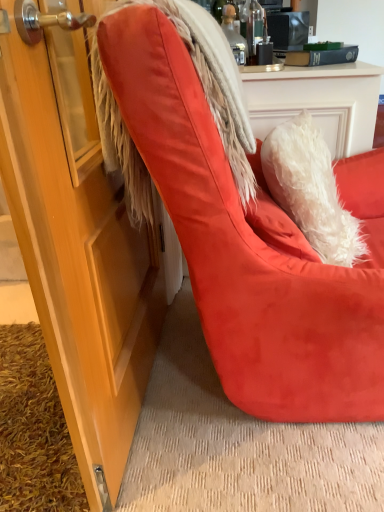
Describe the element at coordinates (120, 146) in the screenshot. The width and height of the screenshot is (384, 512). I see `fuzzy white fur coat at upper right` at that location.

Image resolution: width=384 pixels, height=512 pixels. Find the location of `fuzzy white fur coat at upper right`. fuzzy white fur coat at upper right is located at coordinates (120, 146).

This screenshot has width=384, height=512. What do you see at coordinates (244, 250) in the screenshot? I see `suede orange chair at center` at bounding box center [244, 250].

At what (x,y) coordinates should I click in order to perform the action: click on suede orange chair at center. Please return your answer as a coordinate pair (x, y). Image resolution: width=384 pixels, height=512 pixels. Looking at the image, I should click on (244, 250).

In order to face suede orange chair at center, should I rotate leftwards or rightwards?

You should look right and rotate roughly 16.061 degrees.

Identify the location of fuzzy white fur coat at upper right. (120, 146).

Considering the relative positions of suede orange chair at center and fuzzy white fur coat at upper right in the image provided, is suede orange chair at center to the left or to the right of fuzzy white fur coat at upper right?

Based on their positions, suede orange chair at center is located to the right of fuzzy white fur coat at upper right.

Is the depth of suede orange chair at center greater than that of fuzzy white fur coat at upper right?

No, it is not.

Which is in front, point (190, 237) or point (112, 111)?

The point (112, 111) is closer.

From the image's perspective, is suede orange chair at center below fuzzy white fur coat at upper right?

Correct, suede orange chair at center appears lower than fuzzy white fur coat at upper right in the image.

From a real-world perspective, does suede orange chair at center stand above fuzzy white fur coat at upper right?

Actually, suede orange chair at center is physically below fuzzy white fur coat at upper right in the real world.

Between suede orange chair at center and fuzzy white fur coat at upper right, which one has smaller width?

Thinner between the two is fuzzy white fur coat at upper right.

Considering the relative sizes of suede orange chair at center and fuzzy white fur coat at upper right in the image provided, is suede orange chair at center shorter than fuzzy white fur coat at upper right?

No.

Considering the sizes of objects suede orange chair at center and fuzzy white fur coat at upper right in the image provided, who is smaller, suede orange chair at center or fuzzy white fur coat at upper right?

Smaller between the two is fuzzy white fur coat at upper right.

Is fuzzy white fur coat at upper right a part of suede orange chair at center?

Yes, fuzzy white fur coat at upper right is a part of suede orange chair at center.

Does suede orange chair at center touch fuzzy white fur coat at upper right?

No, suede orange chair at center is not in contact with fuzzy white fur coat at upper right.

Is suede orange chair at center positioned with its back to fuzzy white fur coat at upper right?

Yes, fuzzy white fur coat at upper right is at the back of suede orange chair at center.

What's the angular difference between suede orange chair at center and fuzzy white fur coat at upper right's facing directions?

2.11 degrees.

This screenshot has height=512, width=384. What are the coordinates of `chair in front of the fuzzy white fur coat at upper right` in the screenshot? It's located at (244, 250).

Is fuzzy white fur coat at upper right to the right of suede orange chair at center from the viewer's perspective?

In fact, fuzzy white fur coat at upper right is to the left of suede orange chair at center.

Which object is further away from the camera taking this photo, fuzzy white fur coat at upper right or suede orange chair at center?

fuzzy white fur coat at upper right is further away from the camera.

Is point (200, 78) closer or farther from the camera than point (281, 286)?

Point (200, 78) is positioned closer to the camera compared to point (281, 286).

From the image's perspective, is fuzzy white fur coat at upper right below suede orange chair at center?

No, from the image's perspective, fuzzy white fur coat at upper right is not below suede orange chair at center.

From a real-world perspective, between fuzzy white fur coat at upper right and suede orange chair at center, who is vertically higher?

fuzzy white fur coat at upper right, from a real-world perspective.

Which of these two, fuzzy white fur coat at upper right or suede orange chair at center, is thinner?

fuzzy white fur coat at upper right.

From the picture: Between fuzzy white fur coat at upper right and suede orange chair at center, which one has less height?

fuzzy white fur coat at upper right is shorter.

Which of these two, fuzzy white fur coat at upper right or suede orange chair at center, is smaller?

Smaller between the two is fuzzy white fur coat at upper right.

Which is correct: fuzzy white fur coat at upper right is inside suede orange chair at center, or outside of it?

fuzzy white fur coat at upper right is contained in suede orange chair at center.

Are fuzzy white fur coat at upper right and suede orange chair at center located far from each other?

fuzzy white fur coat at upper right is actually quite close to suede orange chair at center.

Is suede orange chair at center at the back of fuzzy white fur coat at upper right?

Correct, fuzzy white fur coat at upper right is looking away from suede orange chair at center.

In the scene shown: How far apart are fuzzy white fur coat at upper right and suede orange chair at center?

7.69 inches.

Find the location of `fur coat above the suede orange chair at center (from the image's perspective)`. fur coat above the suede orange chair at center (from the image's perspective) is located at coordinates (120, 146).

You are a GUI agent. You are given a task and a screenshot of the screen. Output one action in this format:
    pyautogui.click(x=<x>, y=<y>)
    Task: Click on the fur coat above the suede orange chair at center (from a real-world perspective)
    
    Given the screenshot: What is the action you would take?
    pyautogui.click(x=120, y=146)

Where is `fur coat that appears above the suede orange chair at center (from the image's perspective)`? The image size is (384, 512). fur coat that appears above the suede orange chair at center (from the image's perspective) is located at coordinates (120, 146).